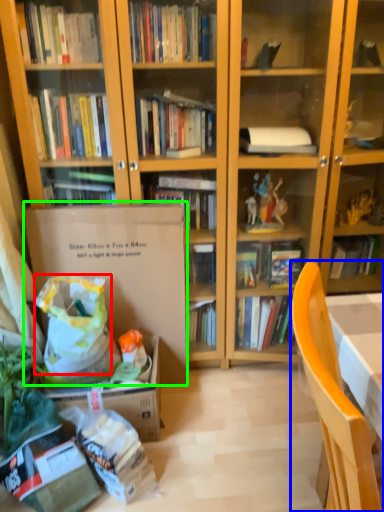
Question: Which object is positioned closest to grocery bag (highlighted by a red box)? Select from chair (highlighted by a blue box) and paperback book (highlighted by a green box).

Choices:
 (A) chair
 (B) paperback book

Answer: (B)